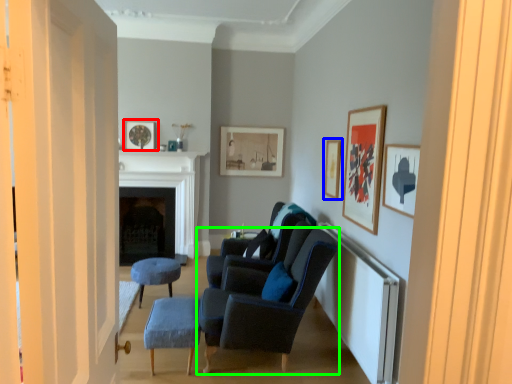
Question: Considering the real-world distances, which object is farthest from picture frame (highlighted by a red box)? picture frame (highlighted by a blue box) or chair (highlighted by a green box)?

Choices:
 (A) picture frame
 (B) chair

Answer: (B)